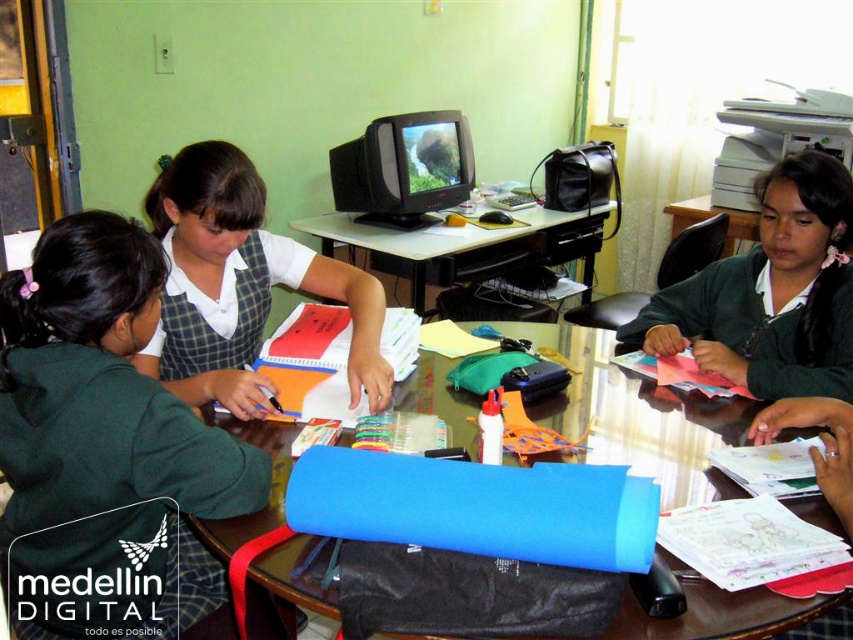
You are a teacher observing the classroom. You notice the blue fabric at center and the green matte uniform at center on the table. Which object is shorter in height?

The blue fabric at center is shorter in height compared to the green matte uniform at center.

You are a student sitting at the table in the classroom. You need to reach for an object located at point A and then another at point B. If point A is point [606,460] and point B is point [808,378], which point should you reach for first to minimize the distance traveled?

You should reach for point A first because it is closer to you than point B. Since point A is in front of point B, you can first reach for point A and then extend your reach to point B without moving your position much.

You are a student in the classroom looking at the table. Can you see the blue fabric at center through the green matte uniform at center?

The blue fabric at center is positioned under the green matte uniform at center, so it is not visible through it.